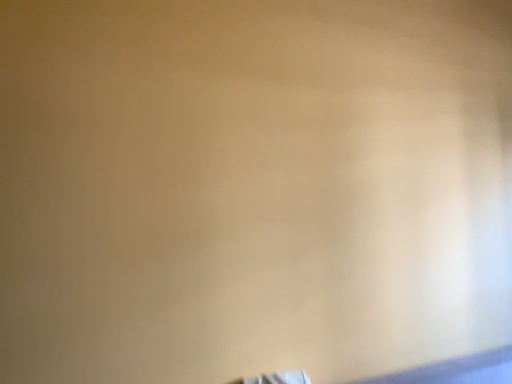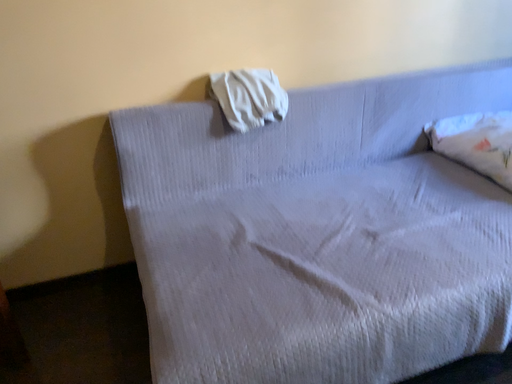
Question: How did the camera likely rotate when shooting the video?

Choices:
 (A) rotated downward
 (B) rotated upward

Answer: (A)